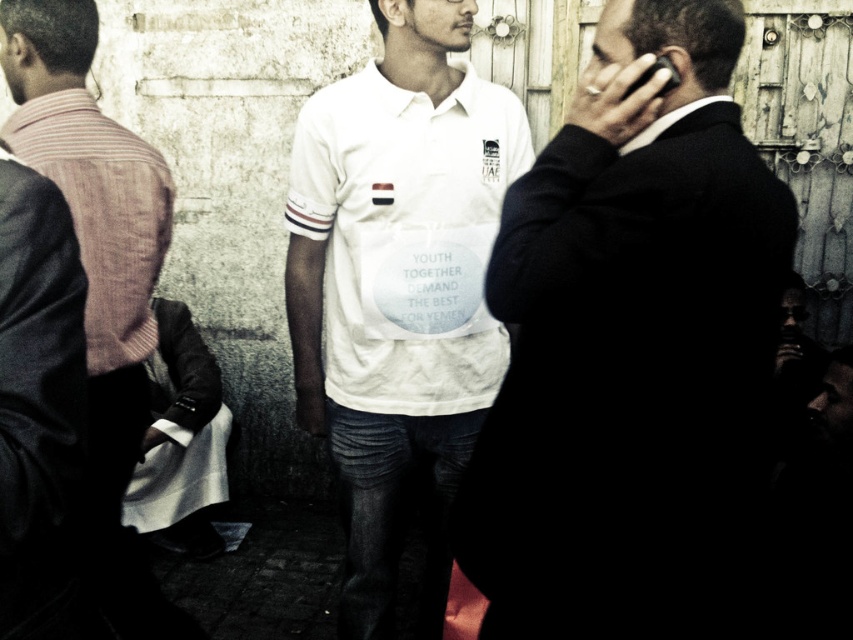
You are a photographer trying to capture a group photo of the white cotton shirt at center and the striped fabric shirt at left. If you want to ensure both shirts are fully visible in the frame, which shirt should you position closer to the camera to avoid cropping?

The striped fabric shirt at left should be positioned closer to the camera because the white cotton shirt at center might be wider, requiring more space in the frame to avoid cropping.

You are a photographer trying to capture a candid shot of the two men in the center of the scene. The black suit at center and the white cotton shirt at center are standing close to each other. If your camera has a minimum focusing distance of 30 inches, will you be able to take a clear photo of both subjects without moving closer?

The distance between the black suit at center and the white cotton shirt at center is 32.20 inches, which is greater than the camera minimum focusing distance of 30 inches. Therefore, you can take a clear photo of both subjects without moving closer.